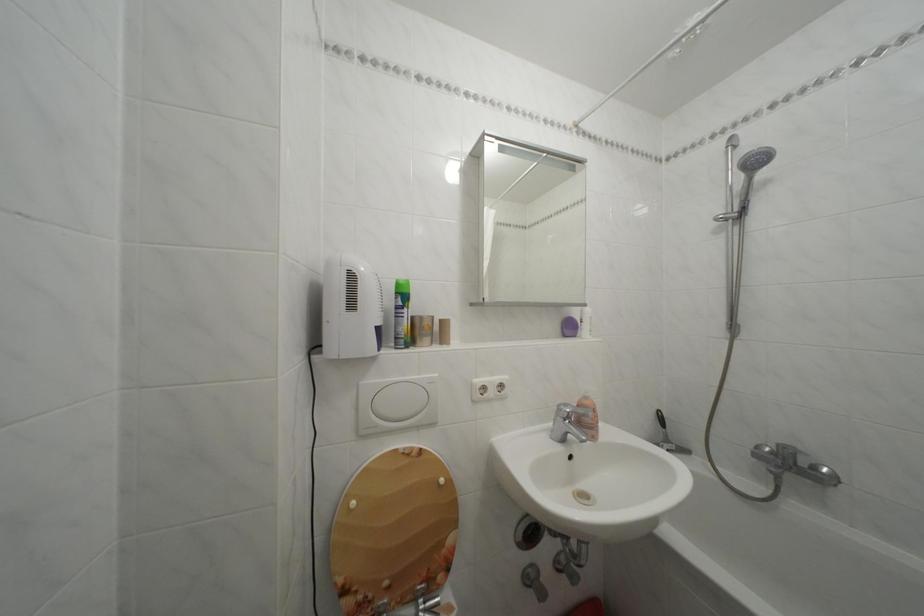
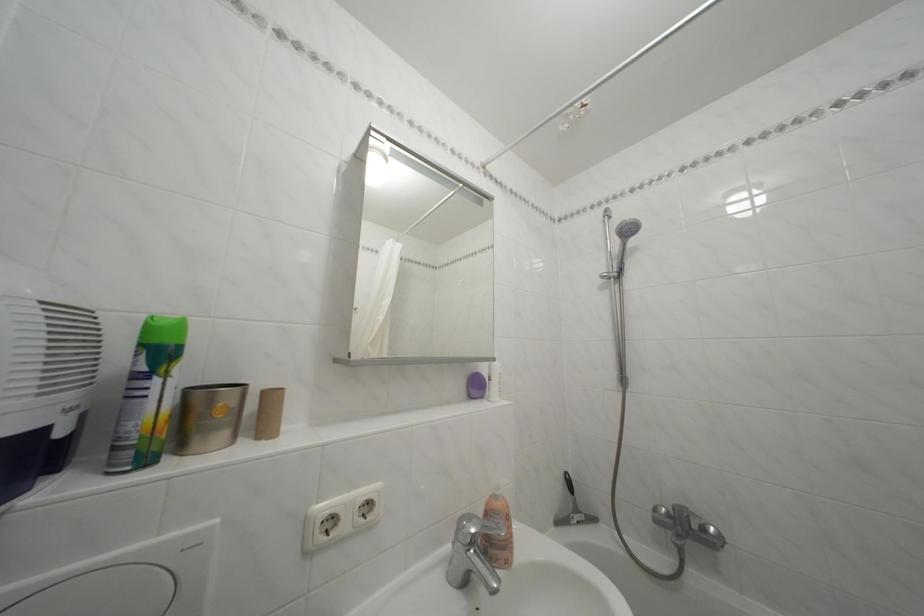
Question: How did the camera likely rotate?

Choices:
 (A) Left
 (B) Right
 (C) Up
 (D) Down

Answer: (B)